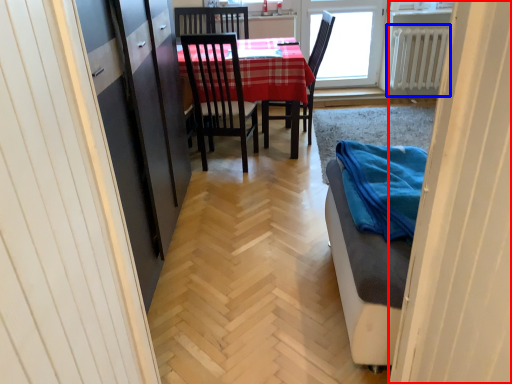
Question: Which of the following is the closest to the observer, door (highlighted by a red box) or radiator (highlighted by a blue box)?

Choices:
 (A) door
 (B) radiator

Answer: (A)